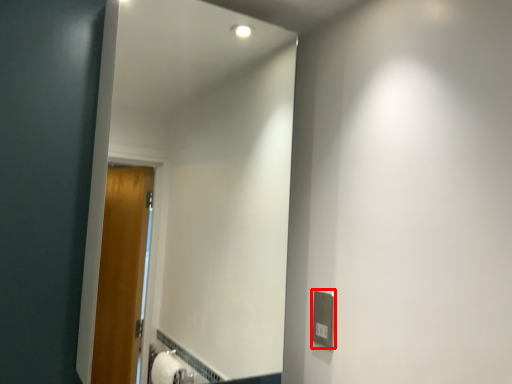
Question: From the image's perspective, what is the correct spatial positioning of electric outlet (annotated by the red box) in reference to mirror?

Choices:
 (A) below
 (B) above

Answer: (A)